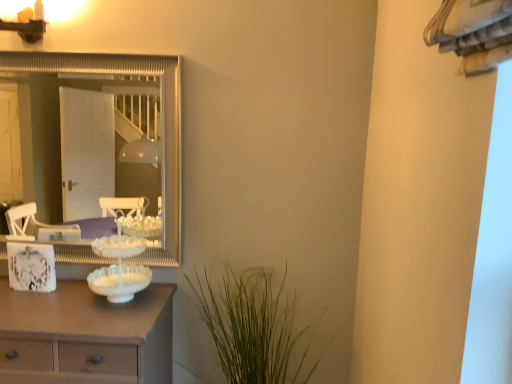
Question: Is silver/metallic mirror at upper left to the left or to the right of white frosted glass candle holder at center in the image?

Choices:
 (A) right
 (B) left

Answer: (B)

Question: In terms of size, does silver/metallic mirror at upper left appear bigger or smaller than white frosted glass candle holder at center?

Choices:
 (A) big
 (B) small

Answer: (A)

Question: Based on their relative distances, which object is nearer to the matte white picture frame at left?

Choices:
 (A) green leafy plant at lower center
 (B) silver/metallic mirror at upper left
 (C) white wood chest of drawers at left
 (D) matte gold sconce at upper left
 (E) white frosted glass candle holder at center

Answer: (E)

Question: Estimate the real-world distances between objects in this image. Which object is closer to the white frosted glass candle holder at center?

Choices:
 (A) matte gold sconce at upper left
 (B) green leafy plant at lower center
 (C) white wood chest of drawers at left
 (D) silver/metallic mirror at upper left
 (E) matte white picture frame at left

Answer: (C)